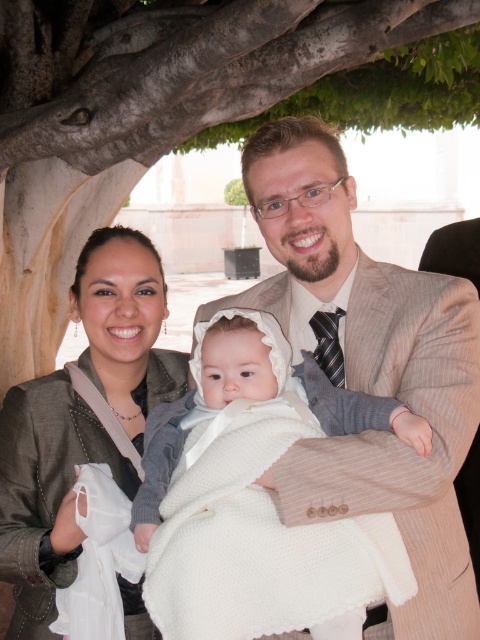
Question: Which point is farther to the camera?

Choices:
 (A) (455, 632)
 (B) (264, 634)
 (C) (158, 72)

Answer: (C)

Question: Where is light brown striped suit at center located in relation to white knitted blanket at center in the image?

Choices:
 (A) above
 (B) below

Answer: (A)

Question: Which is nearer to the white knitted blanket at center?

Choices:
 (A) matte gray jacket at center
 (B) light brown striped suit at center
 (C) brown textured tree trunk at upper center

Answer: (B)

Question: Considering the relative positions of brown textured tree trunk at upper center and white knitted blanket at center in the image provided, where is brown textured tree trunk at upper center located with respect to white knitted blanket at center?

Choices:
 (A) right
 (B) left

Answer: (B)

Question: Is brown textured tree trunk at upper center bigger than light brown striped suit at center?

Choices:
 (A) no
 (B) yes

Answer: (A)

Question: Which point appears farthest from the camera in this image?

Choices:
 (A) (334, 141)
 (B) (268, 374)
 (C) (132, 84)

Answer: (C)